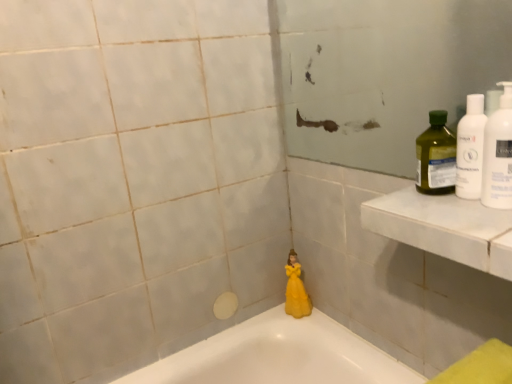
Question: Looking at their shapes, would you say white plastic bottle at upper right, the second cleaning product viewed from the front, is wider or thinner than green plastic bottle at upper right, the third cleaning product viewed from the front?

Choices:
 (A) wide
 (B) thin

Answer: (B)

Question: From the image's perspective, is white plastic bottle at upper right, the second cleaning product viewed from the front, above or below green plastic bottle at upper right, the first cleaning product positioned from the back?

Choices:
 (A) below
 (B) above

Answer: (B)

Question: Considering the real-world distances, which object is closest to the white plastic bottle at upper right, the 2th cleaning product when ordered from back to front?

Choices:
 (A) yellow matte figurine at center
 (B) white marble ledge at upper right
 (C) green plastic bottle at upper right, the third cleaning product viewed from the front
 (D) white plastic bottle at upper right, the 3th cleaning product in the back-to-front sequence

Answer: (D)

Question: Which object is the farthest from the white plastic bottle at upper right, the 3th cleaning product in the back-to-front sequence?

Choices:
 (A) yellow matte figurine at center
 (B) white plastic bottle at upper right, the 2th cleaning product when ordered from back to front
 (C) white marble ledge at upper right
 (D) green plastic bottle at upper right, the first cleaning product positioned from the back

Answer: (A)